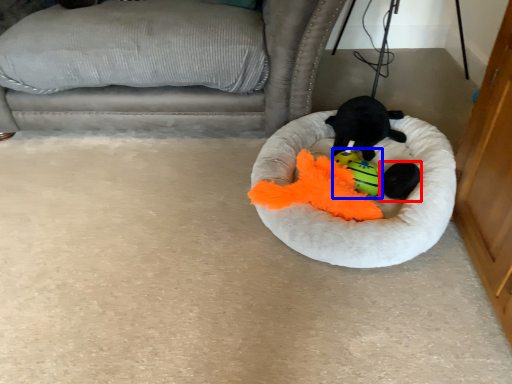
Question: Which object is further to the camera taking this photo, animal (highlighted by a red box) or toy (highlighted by a blue box)?

Choices:
 (A) animal
 (B) toy

Answer: (B)